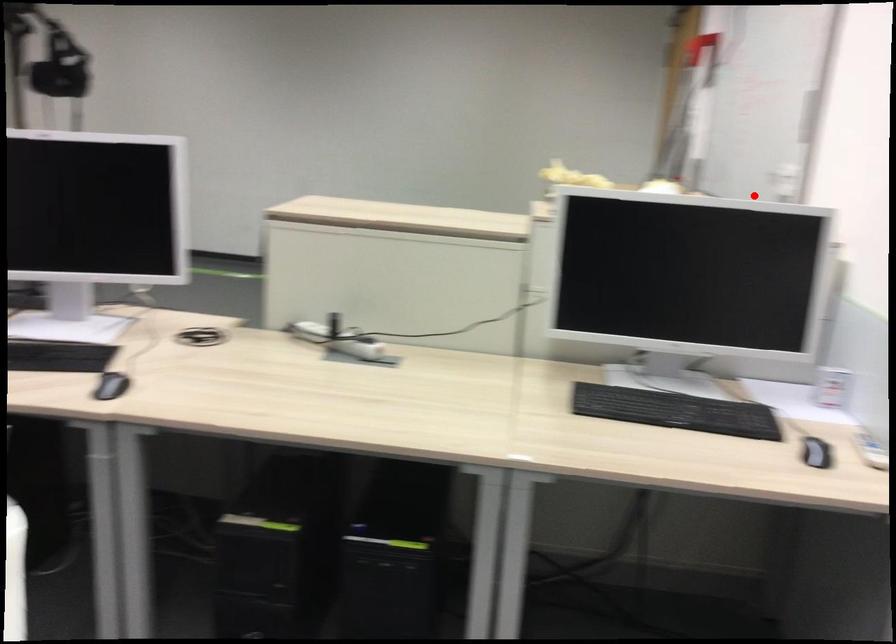
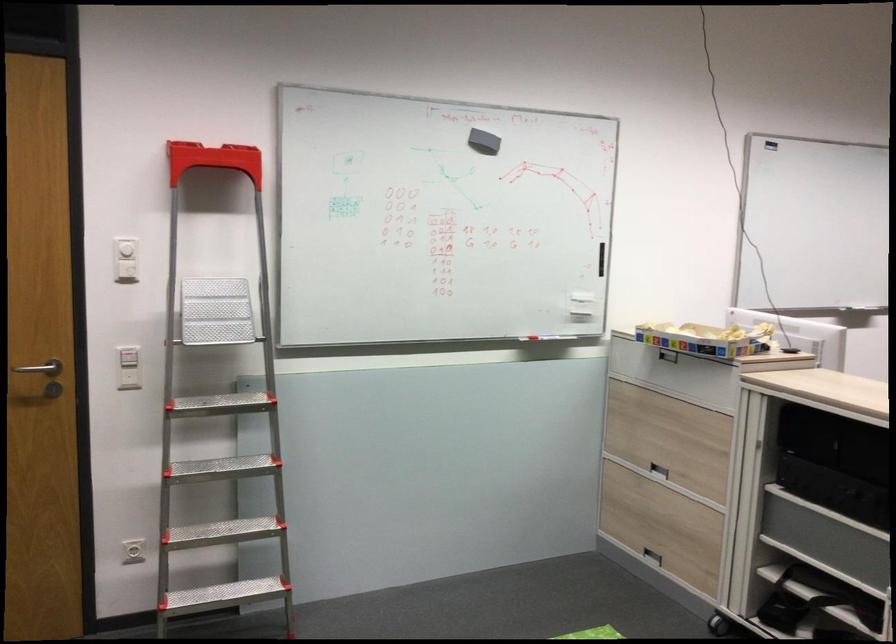
Locate, in the second image, the point that corresponds to the highlighted location in the first image.

(539, 337)